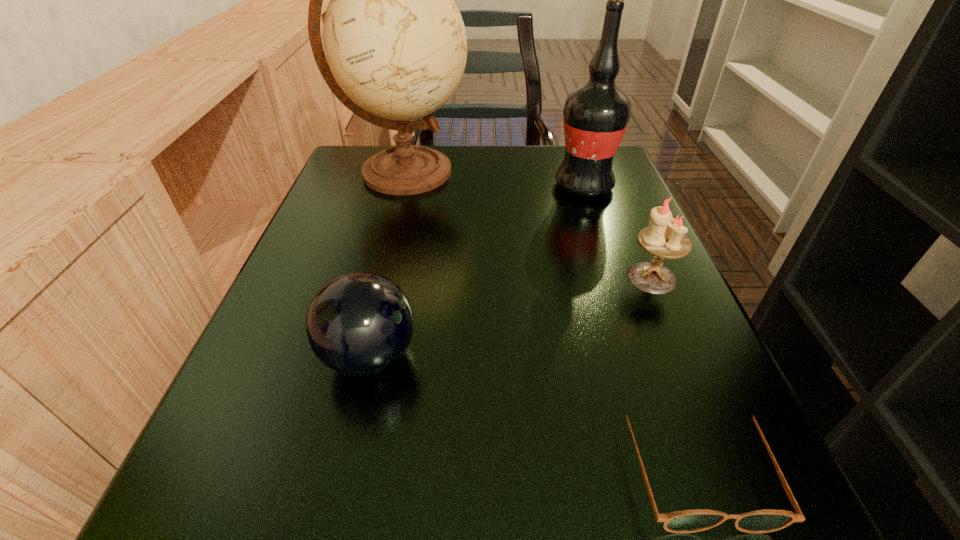
Find the location of a particular element. globe is located at coordinates (395, 42).

Find the location of a particular element. This screenshot has width=960, height=540. the fourth shortest object is located at coordinates (595, 116).

Identify the location of candle holder. (664, 238).

You are a GUI agent. You are given a task and a screenshot of the screen. Output one action in this format:
    pyautogui.click(x=<x>, y=<y>)
    Task: Click on the fourth farthest object
    
    Given the screenshot: What is the action you would take?
    pyautogui.click(x=359, y=324)

Image resolution: width=960 pixels, height=540 pixels. I want to click on bowling ball, so click(x=359, y=324).

What are the coordinates of `the nearest object` in the screenshot? It's located at (687, 521).

The image size is (960, 540). Find the location of `the shortest object`. the shortest object is located at coordinates (687, 521).

Locate an element on the screen. This screenshot has height=540, width=960. free space located 0.320m on the surface of the globe is located at coordinates (618, 172).

The image size is (960, 540). Identify the location of vacant area situated on the front of the wine bottle. [x=624, y=303].

At what (x,y) coordinates should I click in order to perform the action: click on free space located 0.170m on the left of the third farthest object. Please return your answer as a coordinate pair (x, y). Image resolution: width=960 pixels, height=540 pixels. Looking at the image, I should click on (520, 278).